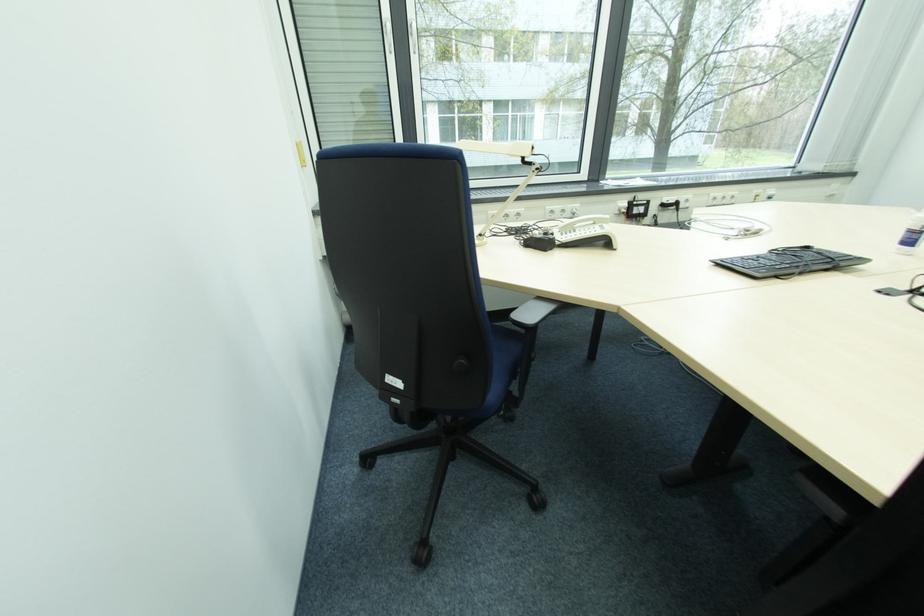
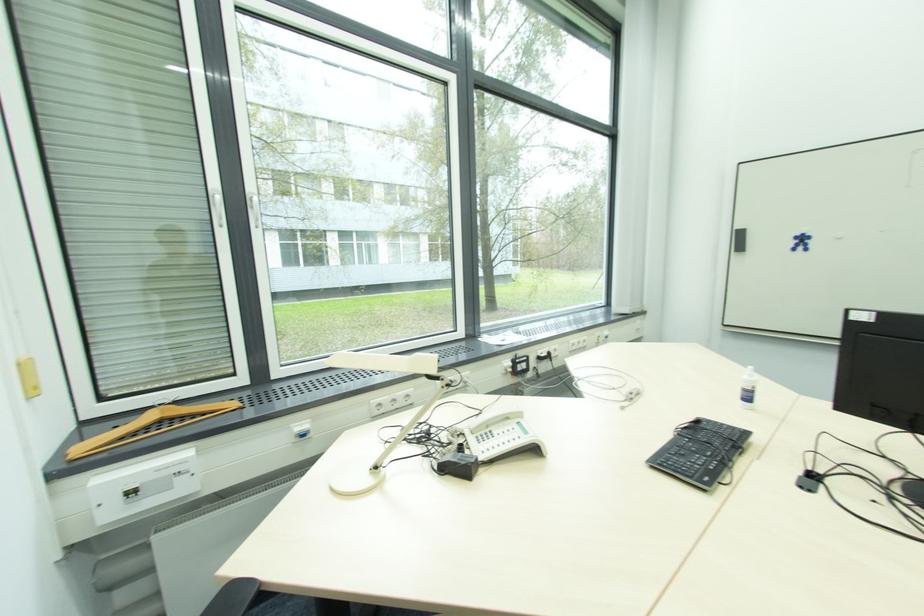
In the second image, find the point that corresponds to point 308,161 in the first image.

(41, 390)